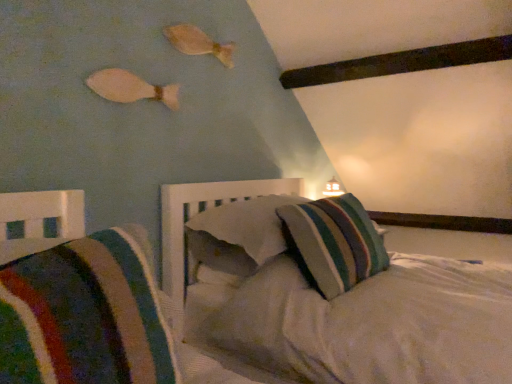
Question: Considering the positions of point (387, 263) and point (177, 26), is point (387, 263) closer or farther from the camera than point (177, 26)?

Choices:
 (A) farther
 (B) closer

Answer: (B)

Question: In the image, is striped fabric pillow at center, which is the second pillow in back-to-front order, on the left side or the right side of wooden fish at upper center, which is the second fish in left-to-right order?

Choices:
 (A) left
 (B) right

Answer: (B)

Question: Estimate the real-world distances between objects in this image. Which object is farther from the striped fabric pillow at center, which is the 1th pillow in front-to-back order?

Choices:
 (A) striped fabric pillow at center, the second pillow positioned from the front
 (B) white matte fish at upper left, which is counted as the second fish, starting from the back
 (C) wooden fish at upper center, placed as the first fish when sorted from back to front
 (D) striped fabric pillow at center, marked as the 3th pillow in a front-to-back arrangement

Answer: (C)

Question: Estimate the real-world distances between objects in this image. Which object is farther from the wooden fish at upper center, the second fish viewed from the front?

Choices:
 (A) striped fabric pillow at center, placed as the first pillow when sorted from back to front
 (B) striped fabric pillow at center, the second pillow positioned from the front
 (C) white matte fish at upper left, the 2th fish positioned from the right
 (D) striped fabric pillow at center, which ranks as the third pillow in back-to-front order

Answer: (D)